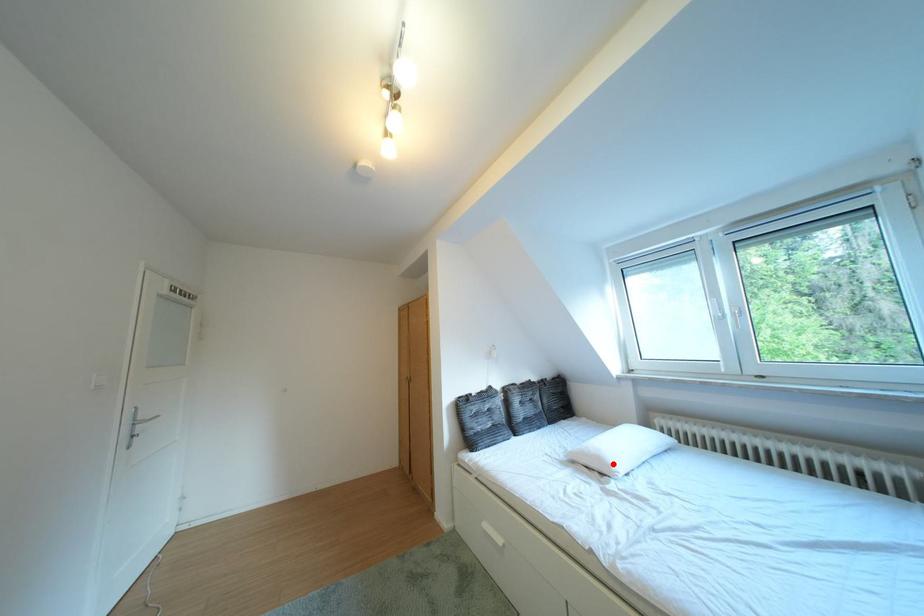
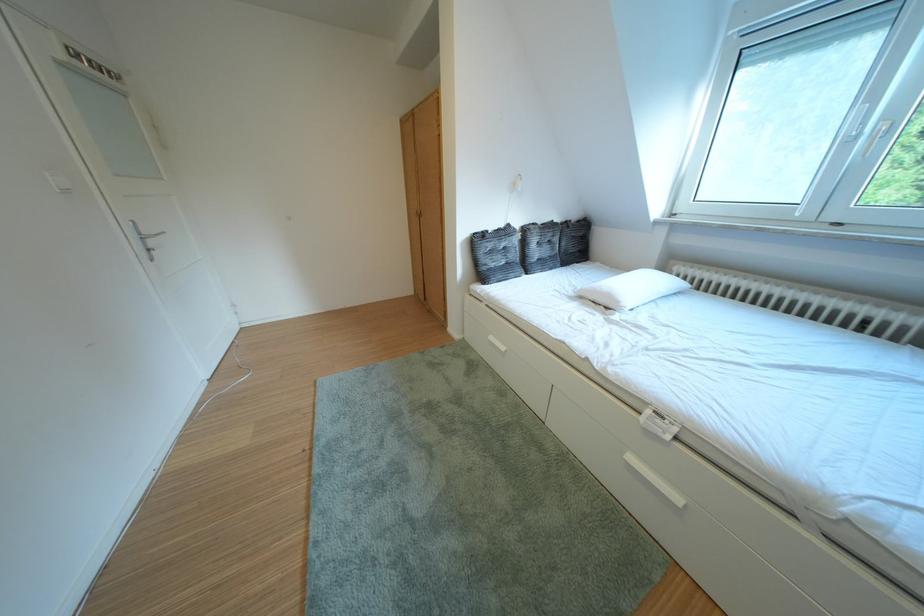
In the second image, find the point that corresponds to the highlighted location in the first image.

(623, 301)